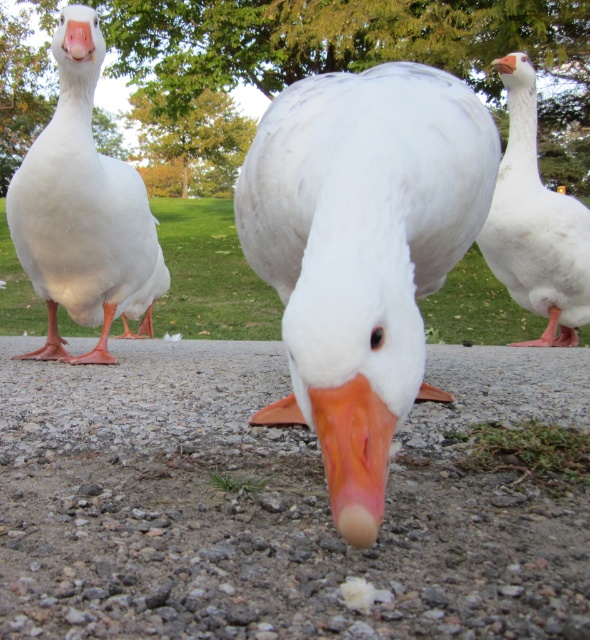
Which is in front, point (329, 243) or point (546, 340)?

Point (329, 243) is more forward.

Which is in front, point (273, 221) or point (512, 273)?

Point (273, 221) is in front.

Where is `white matte duck at center`? white matte duck at center is located at coordinates (362, 250).

Which is more to the left, white matte duck at center or matte white duck at left?

Positioned to the left is matte white duck at left.

Does white matte duck at center have a greater width compared to matte white duck at left?

No.

At what (x,y) coordinates should I click in order to perform the action: click on white matte duck at center. Please return your answer as a coordinate pair (x, y). Looking at the image, I should click on (362, 250).

This screenshot has height=640, width=590. I want to click on white matte duck at center, so click(x=362, y=250).

Can you confirm if matte white duck at left is positioned above white matte goose at upper right?

Incorrect, matte white duck at left is not positioned above white matte goose at upper right.

Between matte white duck at left and white matte goose at upper right, which one has more height?

Standing taller between the two is white matte goose at upper right.

The width and height of the screenshot is (590, 640). I want to click on matte white duck at left, so click(x=78, y=211).